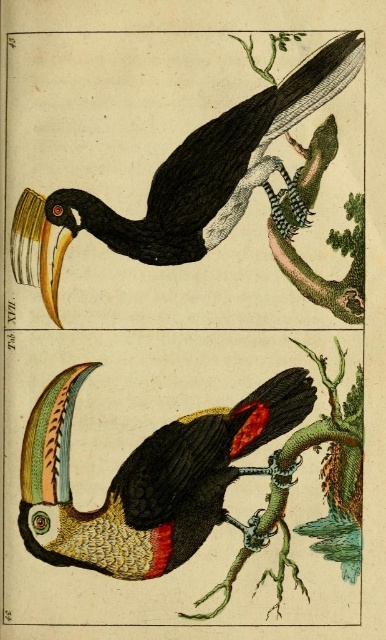
You are standing in front of the illustration and want to touch the point at coordinate point (x=96, y=570). Can you reach it without moving your hand more than 1.25 meters?

The point (x=96, y=570) is 1.30 meters away from the camera, so you cannot reach it without moving your hand more than 1.25 meters.

Consider the image. Based on the coordinates provided, where exactly is the multicolored feathered toucan at center located in the image?

The multicolored feathered toucan at center is located at point coordinates of (147, 477).